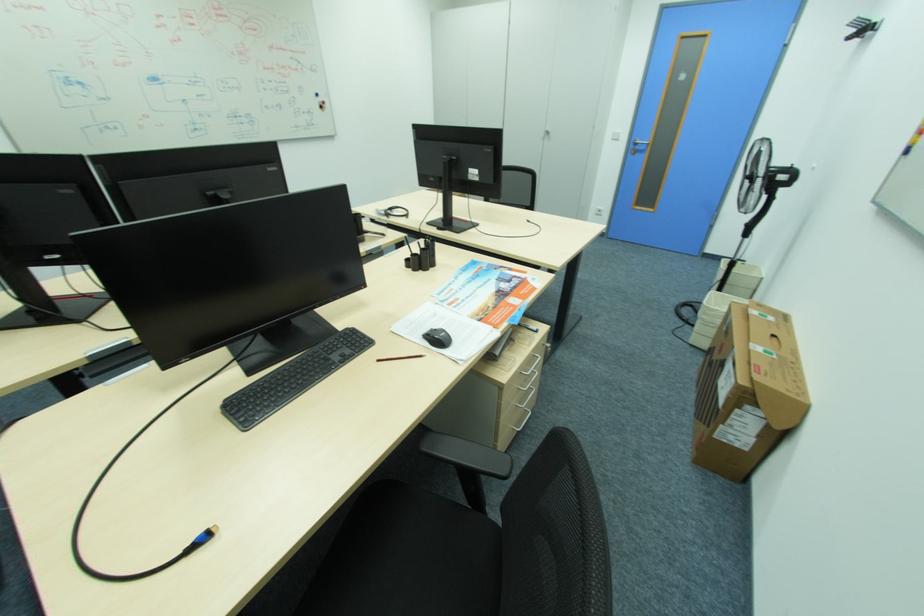
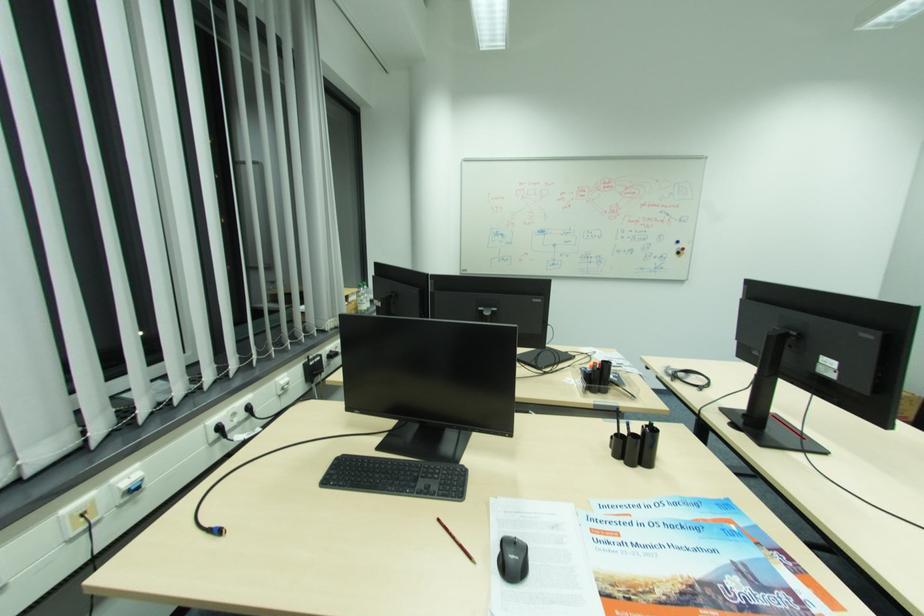
The point at (x=327, y=108) is marked in the first image. Where is the corresponding point in the second image?

(684, 253)